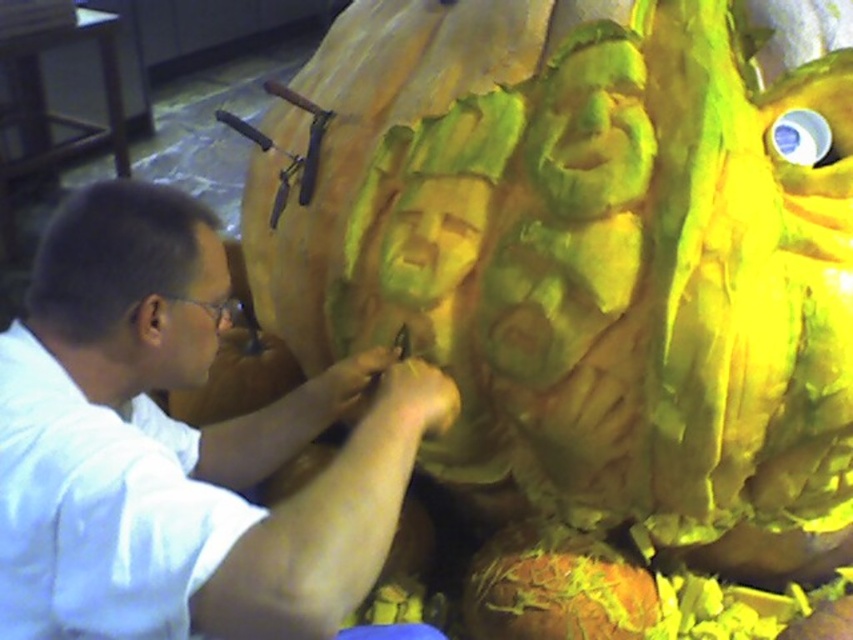
Question: Can you confirm if white matte shirt at center is wider than matte white face at lower left?

Choices:
 (A) yes
 (B) no

Answer: (A)

Question: Which object appears closest to the camera in this image?

Choices:
 (A) green matte pumpkin face at center
 (B) matte white face at lower left

Answer: (B)

Question: Among these objects, which one is nearest to the camera?

Choices:
 (A) white matte shirt at center
 (B) matte white face at lower left
 (C) green matte pumpkin face at center

Answer: (A)

Question: Does green matte pumpkin face at center lie behind matte white face at lower left?

Choices:
 (A) yes
 (B) no

Answer: (A)

Question: Estimate the real-world distances between objects in this image. Which object is closer to the green matte pumpkin face at center?

Choices:
 (A) white matte shirt at center
 (B) matte white face at lower left

Answer: (A)

Question: Is white matte shirt at center to the left of matte white face at lower left from the viewer's perspective?

Choices:
 (A) no
 (B) yes

Answer: (A)